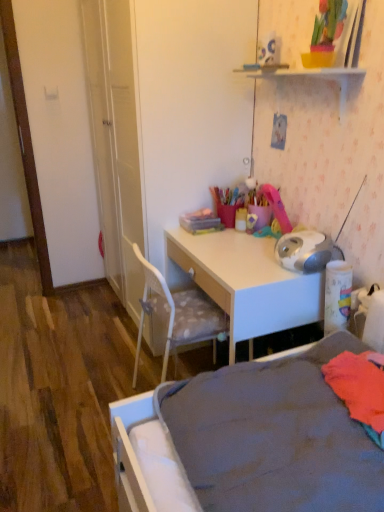
At what (x,y) coordinates should I click in order to perform the action: click on free location above white glossy desk at center (from a real-world perspective). Please return your answer as a coordinate pair (x, y). This screenshot has width=384, height=512. Looking at the image, I should click on (236, 248).